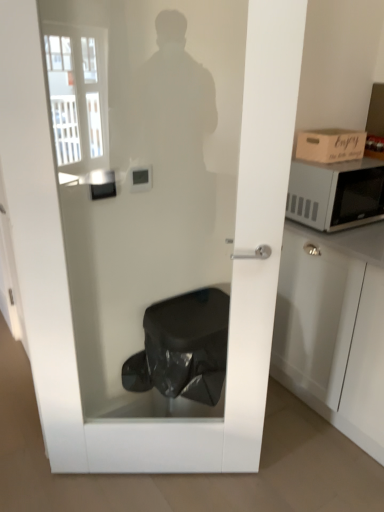
The height and width of the screenshot is (512, 384). What do you see at coordinates (336, 194) in the screenshot?
I see `satin silver microwave at right` at bounding box center [336, 194].

The image size is (384, 512). Identify the location of satin silver microwave at right. (336, 194).

Where is `wooden cardboard box at upper right`? This screenshot has height=512, width=384. wooden cardboard box at upper right is located at coordinates (330, 145).

The height and width of the screenshot is (512, 384). Describe the element at coordinates (330, 145) in the screenshot. I see `wooden cardboard box at upper right` at that location.

In order to face wooden cardboard box at upper right, should I rotate leftwards or rightwards?

Rotate your view right by about 18.274°.

At what (x,y) coordinates should I click in order to perform the action: click on satin silver microwave at right. Please return your answer as a coordinate pair (x, y). Image resolution: width=384 pixels, height=512 pixels. Looking at the image, I should click on (336, 194).

Looking at this image, considering the positions of objects satin silver microwave at right and wooden cardboard box at upper right in the image provided, who is more to the right, satin silver microwave at right or wooden cardboard box at upper right?

From the viewer's perspective, satin silver microwave at right appears more on the right side.

Which object is more forward, satin silver microwave at right or wooden cardboard box at upper right?

satin silver microwave at right is closer to the camera.

Is point (343, 205) farther from viewer compared to point (308, 130)?

That is True.

From the image's perspective, does satin silver microwave at right appear lower than wooden cardboard box at upper right?

Indeed, from the image's perspective, satin silver microwave at right is shown beneath wooden cardboard box at upper right.

From a real-world perspective, who is located lower, satin silver microwave at right or wooden cardboard box at upper right?

satin silver microwave at right, from a real-world perspective.

In terms of width, does satin silver microwave at right look wider or thinner when compared to wooden cardboard box at upper right?

Clearly, satin silver microwave at right has more width compared to wooden cardboard box at upper right.

Considering the sizes of objects satin silver microwave at right and wooden cardboard box at upper right in the image provided, who is taller, satin silver microwave at right or wooden cardboard box at upper right?

satin silver microwave at right.

Is satin silver microwave at right smaller than wooden cardboard box at upper right?

No, satin silver microwave at right is not smaller than wooden cardboard box at upper right.

Choose the correct answer: Is satin silver microwave at right inside wooden cardboard box at upper right or outside it?

satin silver microwave at right lies outside wooden cardboard box at upper right.

Is satin silver microwave at right not close to wooden cardboard box at upper right?

No, there isn't a large distance between satin silver microwave at right and wooden cardboard box at upper right.

Is satin silver microwave at right oriented away from wooden cardboard box at upper right?

No, satin silver microwave at right's orientation is not away from wooden cardboard box at upper right.

What's the angular difference between satin silver microwave at right and wooden cardboard box at upper right's facing directions?

0.00122 degrees separate the facing orientations of satin silver microwave at right and wooden cardboard box at upper right.

This screenshot has width=384, height=512. What are the coordinates of `microwave oven lying on the right of wooden cardboard box at upper right` in the screenshot? It's located at (336, 194).

Is wooden cardboard box at upper right at the left side of satin silver microwave at right?

Yes, wooden cardboard box at upper right is to the left of satin silver microwave at right.

Is the position of wooden cardboard box at upper right less distant than that of satin silver microwave at right?

No, it is behind satin silver microwave at right.

Between point (302, 135) and point (290, 201), which one is positioned in front?

Positioned in front is point (290, 201).

From the image's perspective, is wooden cardboard box at upper right located above satin silver microwave at right?

Indeed, from the image's perspective, wooden cardboard box at upper right is shown above satin silver microwave at right.

From a real-world perspective, is wooden cardboard box at upper right physically below satin silver microwave at right?

No.

Can you confirm if wooden cardboard box at upper right is wider than satin silver microwave at right?

In fact, wooden cardboard box at upper right might be narrower than satin silver microwave at right.

Considering the relative sizes of wooden cardboard box at upper right and satin silver microwave at right in the image provided, is wooden cardboard box at upper right taller than satin silver microwave at right?

In fact, wooden cardboard box at upper right may be shorter than satin silver microwave at right.

Is wooden cardboard box at upper right bigger or smaller than satin silver microwave at right?

wooden cardboard box at upper right is smaller than satin silver microwave at right.

Is wooden cardboard box at upper right not within satin silver microwave at right?

wooden cardboard box at upper right lies outside satin silver microwave at right's area.

Would you say wooden cardboard box at upper right is a long distance from satin silver microwave at right?

No, there isn't a large distance between wooden cardboard box at upper right and satin silver microwave at right.

Is wooden cardboard box at upper right looking in the opposite direction of satin silver microwave at right?

No, wooden cardboard box at upper right's orientation is not away from satin silver microwave at right.

How different are the orientations of wooden cardboard box at upper right and satin silver microwave at right in degrees?

The angle between the facing direction of wooden cardboard box at upper right and the facing direction of satin silver microwave at right is 0.00122 degrees.

Identify the location of cardboard box that is on the left side of satin silver microwave at right. (330, 145).

Locate an element on the screen. Image resolution: width=384 pixels, height=512 pixels. microwave oven in front of the wooden cardboard box at upper right is located at coordinates (336, 194).

Where is `microwave oven below the wooden cardboard box at upper right (from the image's perspective)`? This screenshot has height=512, width=384. microwave oven below the wooden cardboard box at upper right (from the image's perspective) is located at coordinates (336, 194).